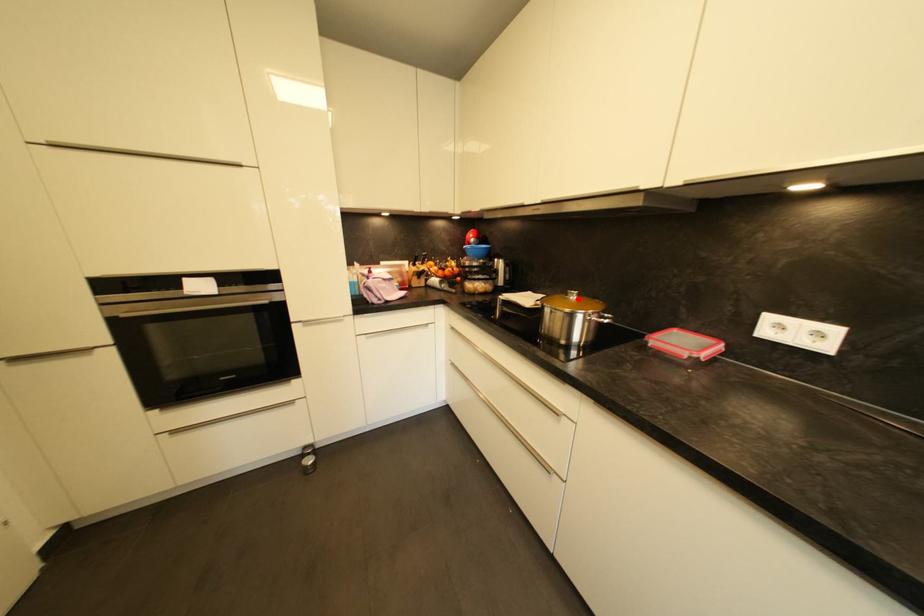
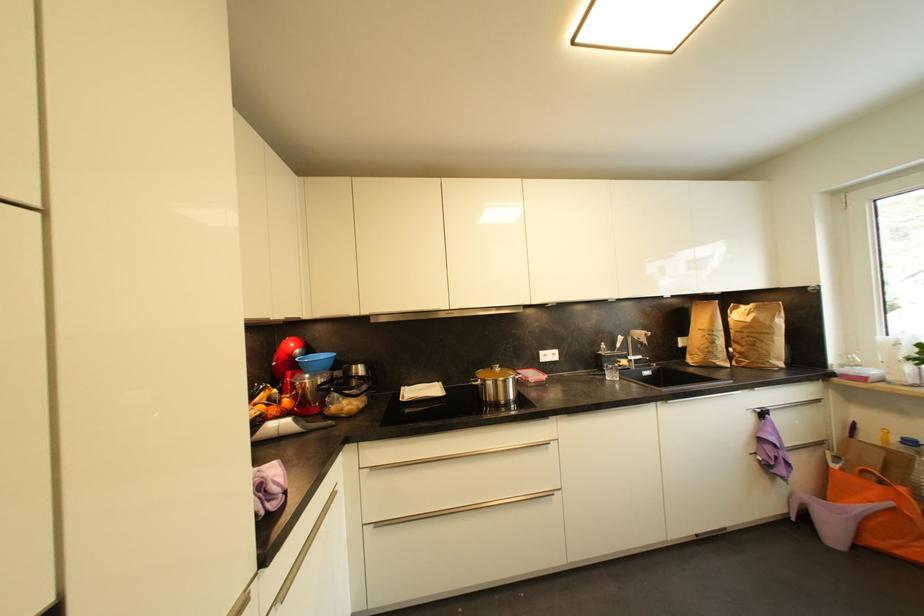
Where in the second image is the point corresponding to the highlighted location from the first image?

(503, 371)